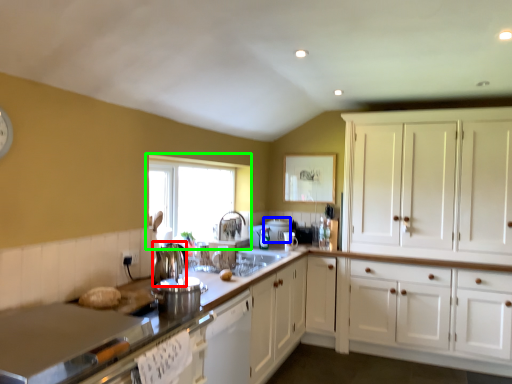
Question: Considering the real-world distances, which object is closest to appliance (highlighted by a red box)? appliance (highlighted by a blue box) or window (highlighted by a green box).

Choices:
 (A) appliance
 (B) window

Answer: (B)